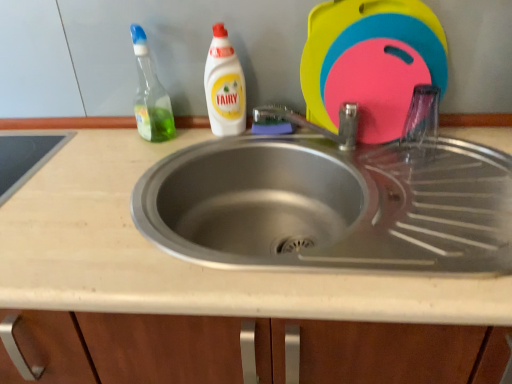
Find the location of a particular element. This screenshot has height=384, width=512. free space in front of green translucent bottle at upper left, placed as the 1th cleaning product when sorted from left to right is located at coordinates 147,160.